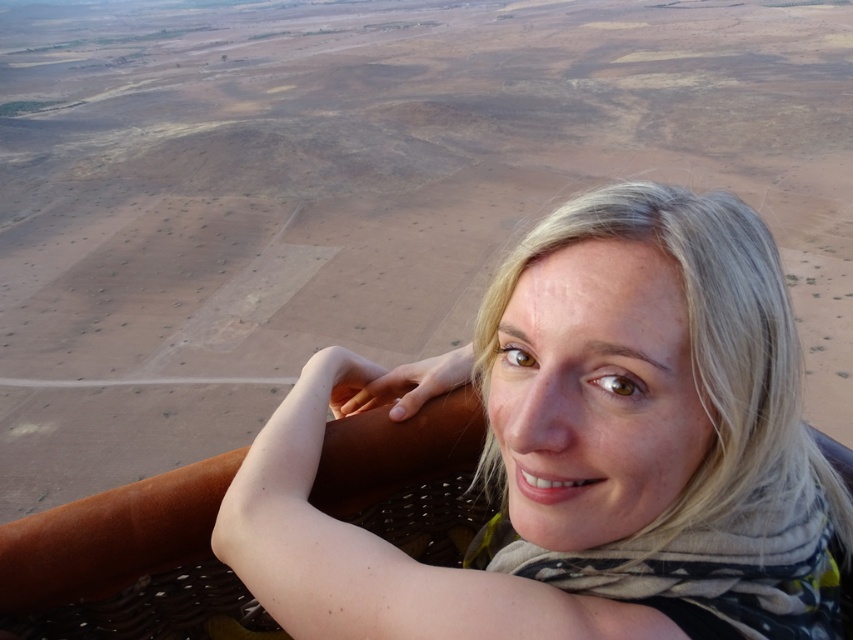
Question: Which point is closer to the camera?

Choices:
 (A) blonde hair at center
 (B) printed cotton scarf at lower right

Answer: (A)

Question: Is blonde hair at center closer to the viewer compared to printed cotton scarf at lower right?

Choices:
 (A) no
 (B) yes

Answer: (B)

Question: Among these objects, which one is farthest from the camera?

Choices:
 (A) blonde hair at center
 (B) printed cotton scarf at lower right

Answer: (B)

Question: Is blonde hair at center wider than printed cotton scarf at lower right?

Choices:
 (A) yes
 (B) no

Answer: (A)

Question: Which point is farther to the camera?

Choices:
 (A) (793, 627)
 (B) (683, 237)

Answer: (A)

Question: Does blonde hair at center appear under printed cotton scarf at lower right?

Choices:
 (A) no
 (B) yes

Answer: (A)